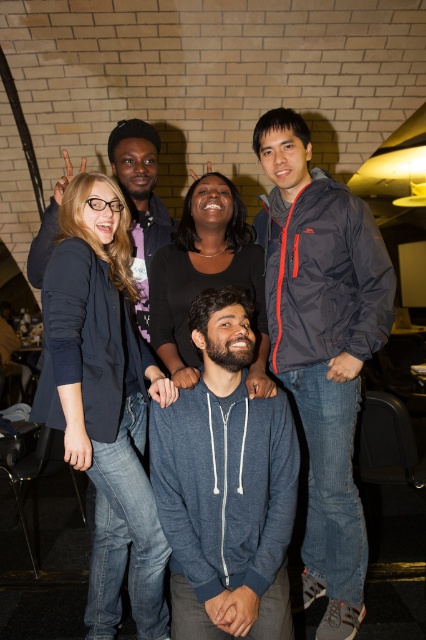
You are a photographer trying to adjust the lighting for a photo. You notice the navy blue jacket at upper right and the dark blue denim jeans at center. Which object should you focus your spotlight on if you want to highlight the taller one?

The navy blue jacket at upper right is taller than the dark blue denim jeans at center, so you should focus the spotlight on the navy blue jacket at upper right.

You are a photographer adjusting your camera settings to focus on the dark blue denim jeans at center and the blue hoodie at center. Which object should you focus on first to ensure clarity, the one closer to the viewer or the one further away?

The dark blue denim jeans at center is closer to the viewer than the blue hoodie at center, so you should focus on the dark blue denim jeans at center first to ensure clarity.

In the image, there is a point at coordinates (322,346). Based on the scene description, which object does this point lie on?

The point at coordinates (322,346) lies on the navy blue jacket at upper right.